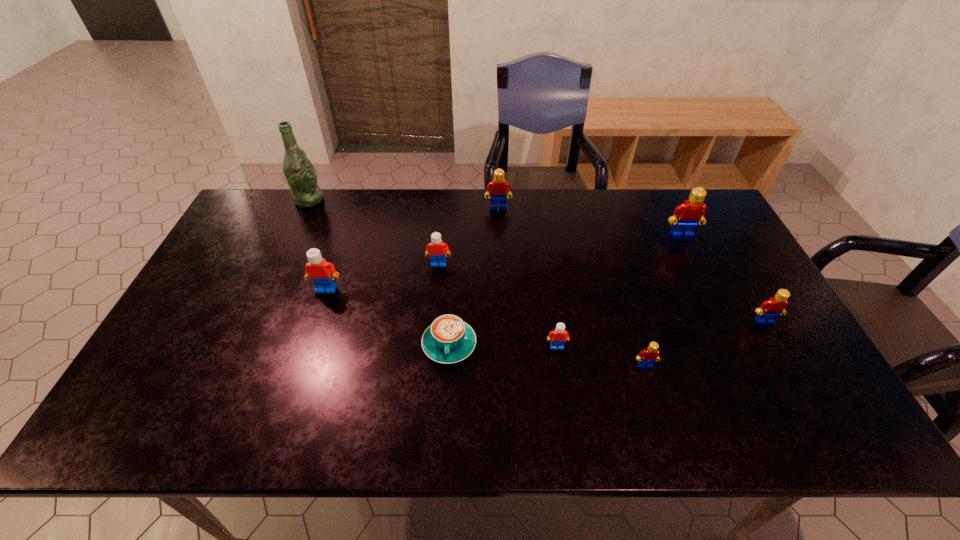
Locate an element on the screen. This screenshot has width=960, height=540. empty space between the fifth object from left to right and the tallest Lego is located at coordinates (589, 221).

The image size is (960, 540). In order to click on free area in between the biggest white Lego and the shortest object in this screenshot , I will do `click(388, 316)`.

Locate an element on the screen. This screenshot has height=540, width=960. free space between the farthest Lego and the leftmost white Lego is located at coordinates coord(412,248).

Where is `free space between the tallest object and the third farthest object`? free space between the tallest object and the third farthest object is located at coordinates (495, 218).

I want to click on vacant space in between the second biggest white Lego and the eighth object from left to right, so click(x=560, y=249).

The image size is (960, 540). Identify the location of empty location between the fourth Lego from left to right and the farthest Lego. (527, 277).

This screenshot has width=960, height=540. Identify the location of object identified as the third closest to the turquoise cappuccino. (322, 273).

You are a GUI agent. You are given a task and a screenshot of the screen. Output one action in this format:
    pyautogui.click(x=<x>, y=<y>)
    Task: Click on the object that stands as the seventh closest to the leftmost red Lego
    This screenshot has width=960, height=540.
    Given the screenshot: What is the action you would take?
    pyautogui.click(x=651, y=354)

Choose which Lego is the third nearest neighbor to the third nearest Lego. Please provide its 2D coordinates. Your answer should be formatted as a tuple, i.e. [(x, y)], where the tuple contains the x and y coordinates of a point satisfying the conditions above.

[(559, 335)]

This screenshot has width=960, height=540. I want to click on Lego that stands as the fifth closest to the sixth nearest object, so click(x=690, y=213).